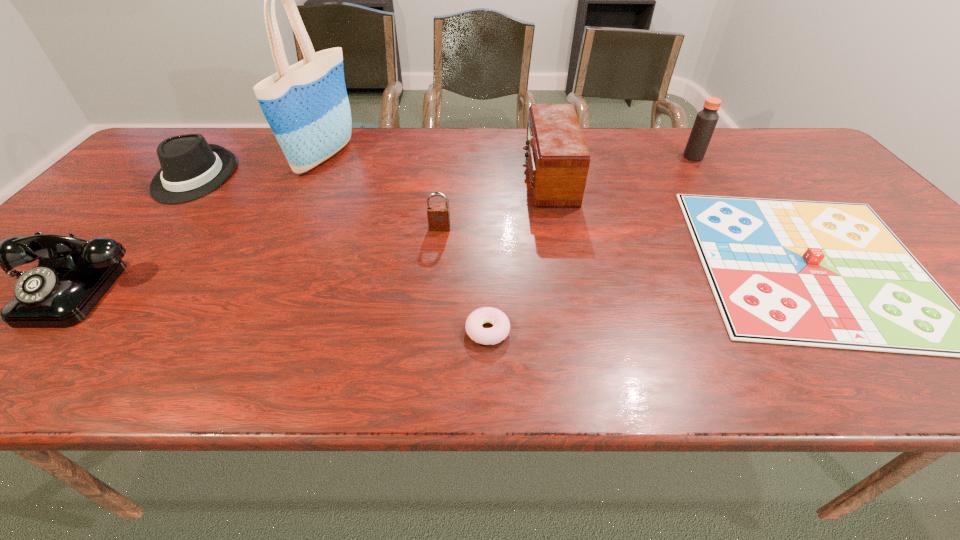
In order to click on object that is the second nearest to the shortest object in this screenshot , I will do `click(558, 159)`.